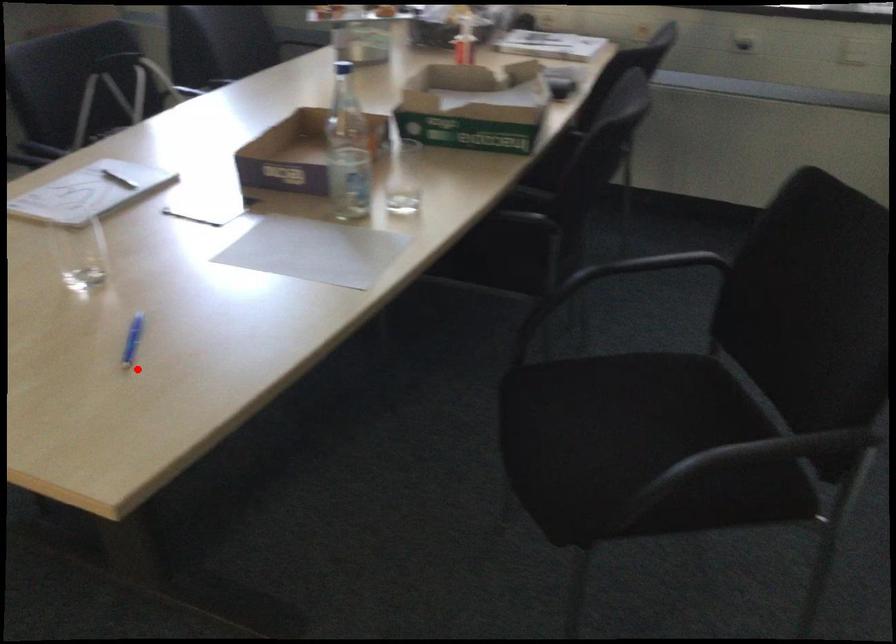
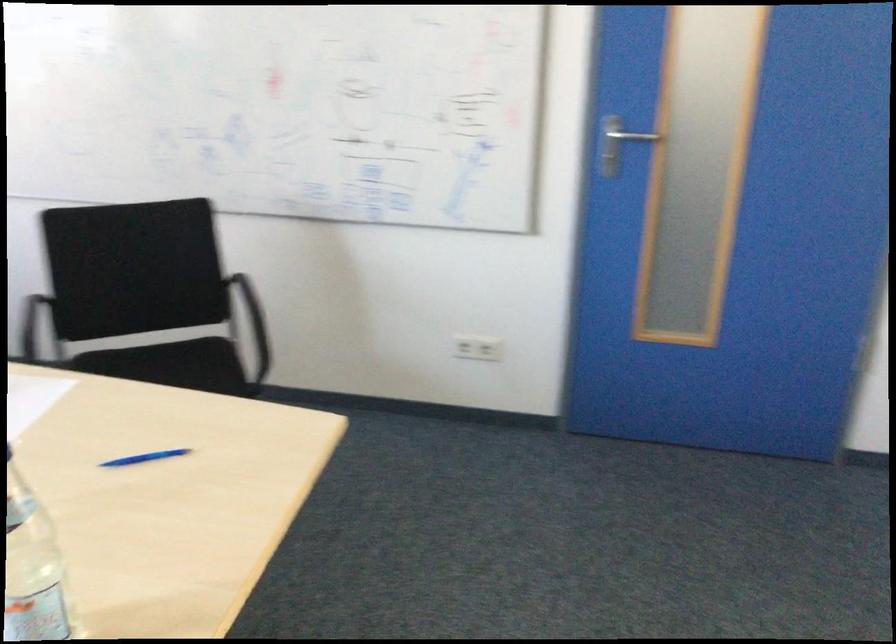
Question: I am providing you with two images of the same scene from different viewpoints. Given a red point in image1, look at the same physical point in image2. Is it:

Choices:
 (A) Closer to the viewpoint
 (B) Farther from the viewpoint

Answer: (B)